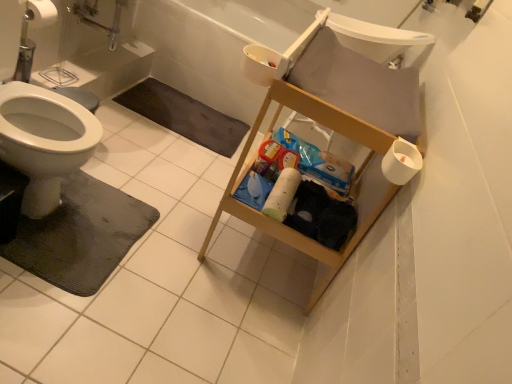
Question: Is black rubber bath mat at lower left, acting as the 2th bath mat starting from the bottom, facing away from black rubber bath mat at lower left, which is counted as the second bath mat, starting from the top?

Choices:
 (A) yes
 (B) no

Answer: (B)

Question: Is black rubber bath mat at lower left, acting as the 2th bath mat starting from the front, aimed at black rubber bath mat at lower left, which is counted as the second bath mat, starting from the top?

Choices:
 (A) yes
 (B) no

Answer: (A)

Question: Could black rubber bath mat at lower left, which ranks as the 1th bath mat in front-to-back order, be considered to be inside black rubber bath mat at lower left, acting as the 2th bath mat starting from the front?

Choices:
 (A) yes
 (B) no

Answer: (B)

Question: Is black rubber bath mat at lower left, acting as the 2th bath mat starting from the bottom, at the left side of black rubber bath mat at lower left, which ranks as the first bath mat in bottom-to-top order?

Choices:
 (A) no
 (B) yes

Answer: (A)

Question: From the image's perspective, does black rubber bath mat at lower left, placed as the first bath mat when sorted from top to bottom, appear higher than black rubber bath mat at lower left, which ranks as the first bath mat in bottom-to-top order?

Choices:
 (A) yes
 (B) no

Answer: (A)

Question: Can you confirm if black rubber bath mat at lower left, acting as the 2th bath mat starting from the bottom, is shorter than black rubber bath mat at lower left, which is counted as the second bath mat, starting from the top?

Choices:
 (A) yes
 (B) no

Answer: (A)

Question: Is black rubber bath mat at lower left, placed as the first bath mat when sorted from top to bottom, outside white plastic bathtub at upper center?

Choices:
 (A) no
 (B) yes

Answer: (B)

Question: Considering the relative sizes of black rubber bath mat at lower left, placed as the first bath mat when sorted from top to bottom, and white plastic bathtub at upper center in the image provided, is black rubber bath mat at lower left, placed as the first bath mat when sorted from top to bottom, thinner than white plastic bathtub at upper center?

Choices:
 (A) yes
 (B) no

Answer: (A)

Question: Is black rubber bath mat at lower left, the first bath mat viewed from the back, looking in the opposite direction of white plastic bathtub at upper center?

Choices:
 (A) no
 (B) yes

Answer: (A)

Question: Does black rubber bath mat at lower left, the first bath mat viewed from the back, come behind white plastic bathtub at upper center?

Choices:
 (A) yes
 (B) no

Answer: (B)

Question: From the image's perspective, is black rubber bath mat at lower left, acting as the 2th bath mat starting from the bottom, above white plastic bathtub at upper center?

Choices:
 (A) no
 (B) yes

Answer: (A)

Question: Does black rubber bath mat at lower left, placed as the first bath mat when sorted from top to bottom, appear on the right side of white plastic bathtub at upper center?

Choices:
 (A) no
 (B) yes

Answer: (A)

Question: From the image's perspective, is white plastic sink at upper right beneath black rubber bath mat at lower left, acting as the 2th bath mat starting from the front?

Choices:
 (A) yes
 (B) no

Answer: (B)